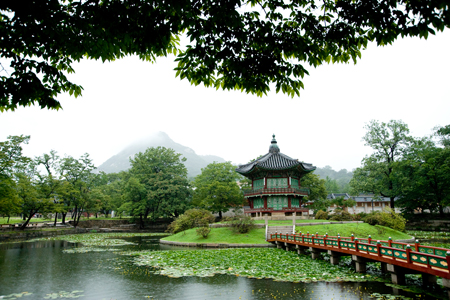
Find the location of a particular element. The image size is (450, 300). windows is located at coordinates (276, 183), (261, 184), (259, 201), (275, 201), (296, 201), (296, 186).